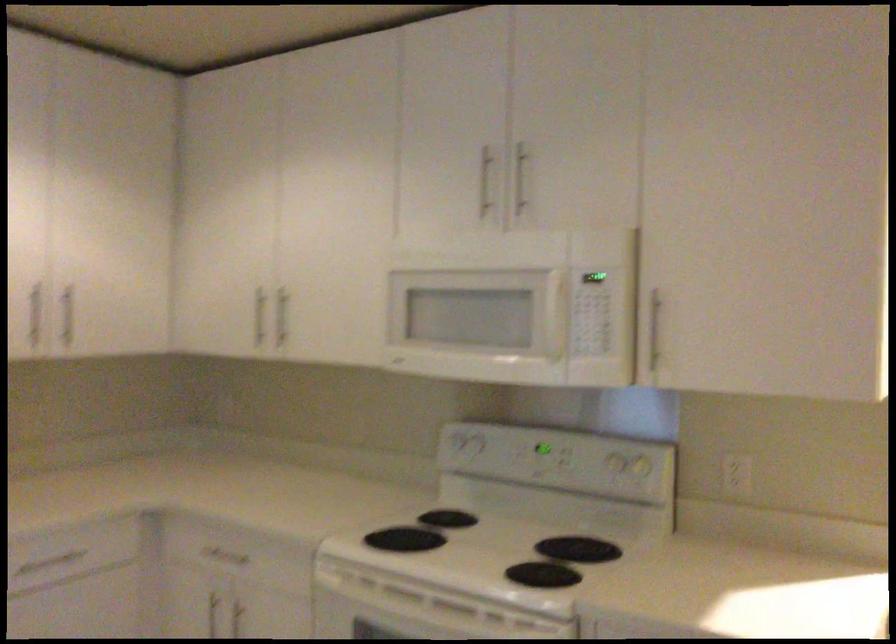
Describe the element at coordinates (737, 474) in the screenshot. The image size is (896, 644). I see `a white electrical outlet` at that location.